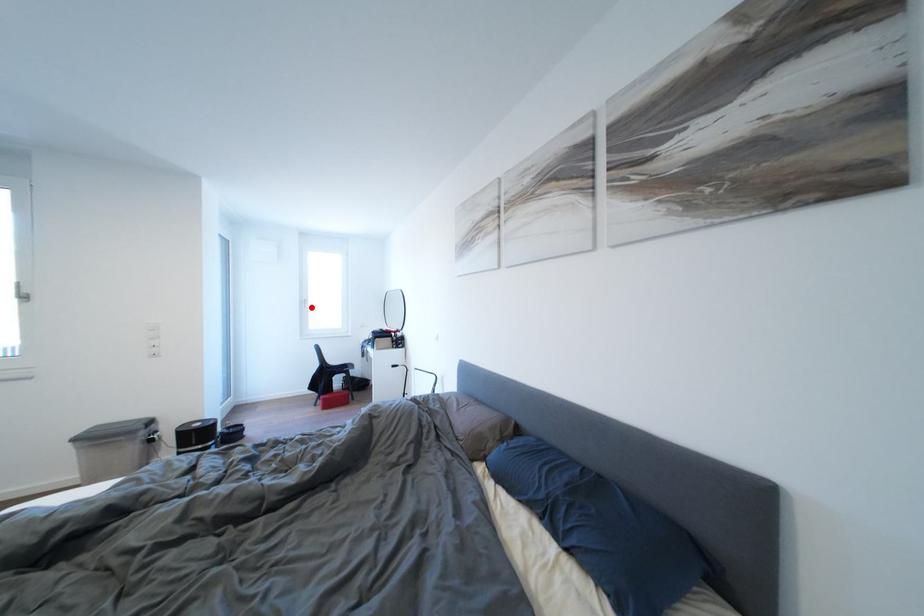
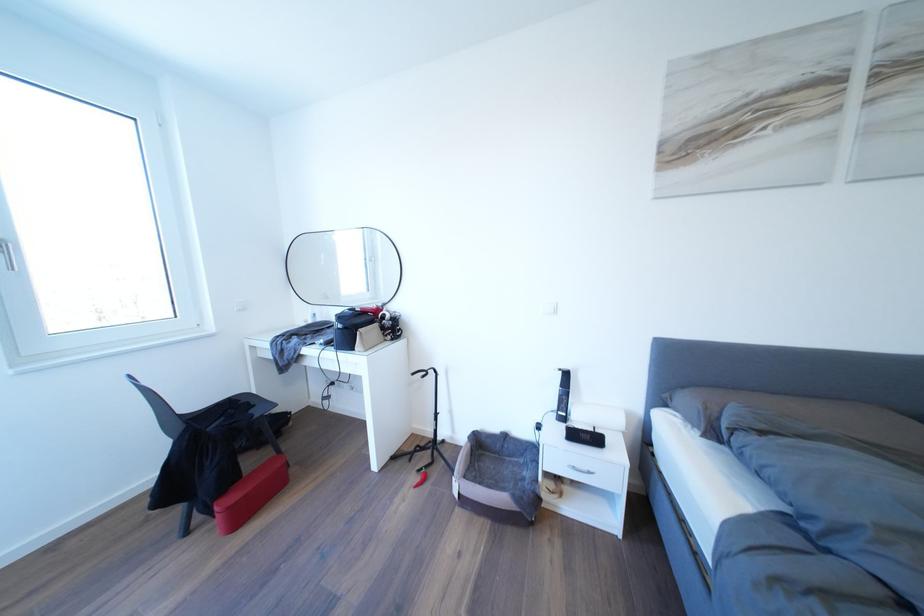
Question: A red point is marked in image1. In image2, is the corresponding 3D point closer to the camera or farther? Reply with the corresponding letter.

Choices:
 (A) The corresponding 3D point is closer.
 (B) The corresponding 3D point is farther.

Answer: (B)